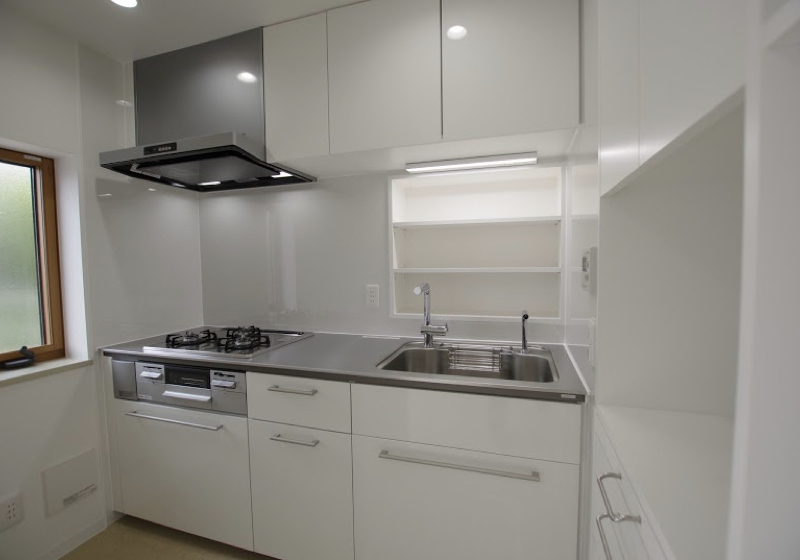
At what (x,y) coordinates should I click in order to perform the action: click on wood floor. Please return your answer as a coordinate pair (x, y). Looking at the image, I should click on (150, 544).